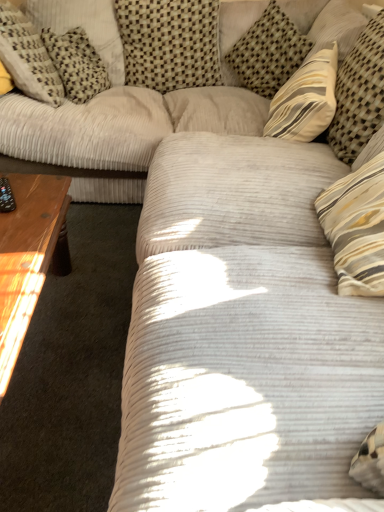
Question: Is striped fabric pillow at upper right, the 1th pillow when ordered from right to left, taller than white corduroy pillow at upper left, marked as the first pillow in a left-to-right arrangement?

Choices:
 (A) yes
 (B) no

Answer: (A)

Question: Considering the relative sizes of striped fabric pillow at upper right, the 5th pillow in the left-to-right sequence, and white corduroy pillow at upper left, which is counted as the 5th pillow, starting from the right, in the image provided, is striped fabric pillow at upper right, the 5th pillow in the left-to-right sequence, thinner than white corduroy pillow at upper left, which is counted as the 5th pillow, starting from the right,?

Choices:
 (A) yes
 (B) no

Answer: (A)

Question: Is white corduroy pillow at upper left, which is counted as the 5th pillow, starting from the right, at the back of striped fabric pillow at upper right, the 5th pillow in the left-to-right sequence?

Choices:
 (A) no
 (B) yes

Answer: (A)

Question: Could white corduroy pillow at upper left, marked as the first pillow in a left-to-right arrangement, be considered to be inside striped fabric pillow at upper right, the 5th pillow in the left-to-right sequence?

Choices:
 (A) yes
 (B) no

Answer: (B)

Question: From the image's perspective, is striped fabric pillow at upper right, the 5th pillow in the left-to-right sequence, located beneath white corduroy pillow at upper left, marked as the first pillow in a left-to-right arrangement?

Choices:
 (A) yes
 (B) no

Answer: (A)

Question: Considering the positions of woven beige pillow at upper center, the third pillow from the left, and white corduroy pillow at upper left, which is counted as the 5th pillow, starting from the right, in the image, is woven beige pillow at upper center, the third pillow from the left, bigger or smaller than white corduroy pillow at upper left, which is counted as the 5th pillow, starting from the right,?

Choices:
 (A) big
 (B) small

Answer: (A)

Question: Is woven beige pillow at upper center, the 3th pillow from the right, inside or outside of white corduroy pillow at upper left, marked as the first pillow in a left-to-right arrangement?

Choices:
 (A) outside
 (B) inside

Answer: (A)

Question: Considering the positions of woven beige pillow at upper center, the third pillow from the left, and white corduroy pillow at upper left, marked as the first pillow in a left-to-right arrangement, in the image, is woven beige pillow at upper center, the third pillow from the left, wider or thinner than white corduroy pillow at upper left, marked as the first pillow in a left-to-right arrangement,?

Choices:
 (A) wide
 (B) thin

Answer: (B)

Question: Considering the relative positions of woven beige pillow at upper center, the third pillow from the left, and white corduroy pillow at upper left, marked as the first pillow in a left-to-right arrangement, in the image provided, is woven beige pillow at upper center, the third pillow from the left, to the left or to the right of white corduroy pillow at upper left, marked as the first pillow in a left-to-right arrangement,?

Choices:
 (A) left
 (B) right

Answer: (B)

Question: In terms of height, does light brown wooden coffee table at left look taller or shorter compared to checkered fabric pillow at upper left, which is the 2th pillow in left-to-right order?

Choices:
 (A) tall
 (B) short

Answer: (B)

Question: From the image's perspective, is light brown wooden coffee table at left positioned above or below checkered fabric pillow at upper left, which is the 2th pillow in left-to-right order?

Choices:
 (A) below
 (B) above

Answer: (A)

Question: Looking at their shapes, would you say light brown wooden coffee table at left is wider or thinner than checkered fabric pillow at upper left, which ranks as the fourth pillow in right-to-left order?

Choices:
 (A) wide
 (B) thin

Answer: (A)

Question: From a real-world perspective, is light brown wooden coffee table at left above or below checkered fabric pillow at upper left, which ranks as the fourth pillow in right-to-left order?

Choices:
 (A) below
 (B) above

Answer: (A)

Question: Considering the positions of point (155, 3) and point (26, 256), is point (155, 3) closer or farther from the camera than point (26, 256)?

Choices:
 (A) closer
 (B) farther

Answer: (B)

Question: Is woven beige pillow at upper center, the 3th pillow from the right, bigger or smaller than light brown wooden coffee table at left?

Choices:
 (A) small
 (B) big

Answer: (A)